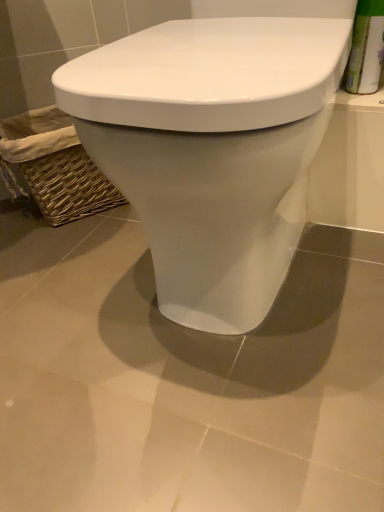
Question: Looking at the image, does white glossy toilet at center seem bigger or smaller compared to woven brown basket at lower left?

Choices:
 (A) big
 (B) small

Answer: (A)

Question: From their relative heights in the image, would you say white glossy toilet at center is taller or shorter than woven brown basket at lower left?

Choices:
 (A) short
 (B) tall

Answer: (B)

Question: From the image's perspective, is white glossy toilet at center positioned above or below woven brown basket at lower left?

Choices:
 (A) below
 (B) above

Answer: (A)

Question: Considering the positions of woven brown basket at lower left and white glossy toilet at center in the image, is woven brown basket at lower left taller or shorter than white glossy toilet at center?

Choices:
 (A) short
 (B) tall

Answer: (A)

Question: From the image's perspective, is woven brown basket at lower left positioned above or below white glossy toilet at center?

Choices:
 (A) below
 (B) above

Answer: (B)

Question: Considering the positions of point (66, 195) and point (215, 47), is point (66, 195) closer or farther from the camera than point (215, 47)?

Choices:
 (A) farther
 (B) closer

Answer: (A)

Question: In the image, is woven brown basket at lower left positioned in front of or behind white glossy toilet at center?

Choices:
 (A) behind
 (B) front

Answer: (A)